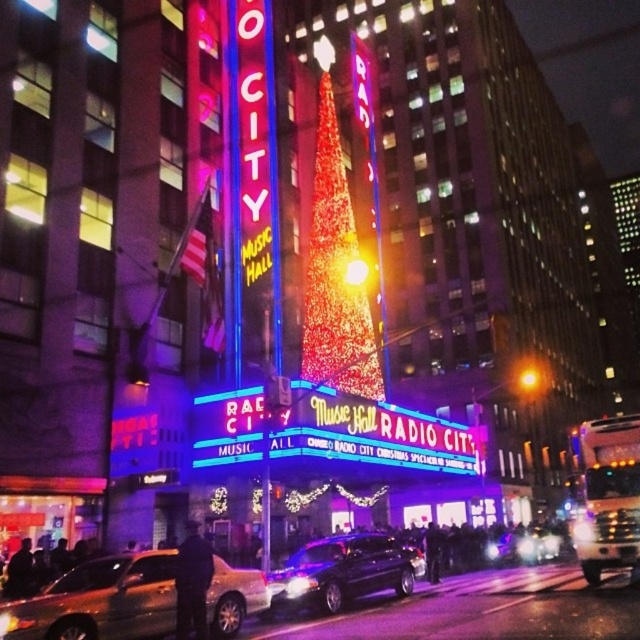
Can you confirm if shiny black sedan at center is positioned above metallic silver car at center?

Correct, shiny black sedan at center is located above metallic silver car at center.

Does shiny black sedan at center appear on the right side of metallic silver car at center?

In fact, shiny black sedan at center is to the left of metallic silver car at center.

Is point (308, 608) farther from viewer compared to point (550, 538)?

No, (308, 608) is in front of (550, 538).

What are the coordinates of `shiny black sedan at center` in the screenshot? It's located at (342, 572).

Is gold metallic car at lower left above shiny black sedan at center?

Correct, gold metallic car at lower left is located above shiny black sedan at center.

Based on the photo, is gold metallic car at lower left smaller than shiny black sedan at center?

Yes, gold metallic car at lower left is smaller than shiny black sedan at center.

Describe the element at coordinates (100, 600) in the screenshot. I see `gold metallic car at lower left` at that location.

At what (x,y) coordinates should I click in order to perform the action: click on gold metallic car at lower left. Please return your answer as a coordinate pair (x, y). Looking at the image, I should click on (100, 600).

Does gold metallic car at lower left lie in front of metallic silver car at center?

That is True.

Is point (96, 579) closer to viewer compared to point (516, 545)?

Yes.

Identify the location of gold metallic car at lower left. The width and height of the screenshot is (640, 640). (100, 600).